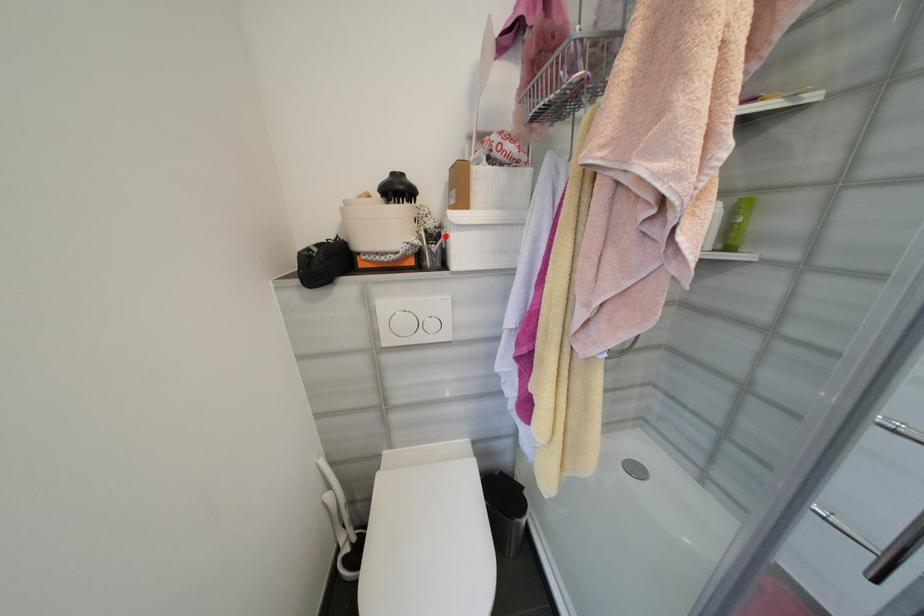
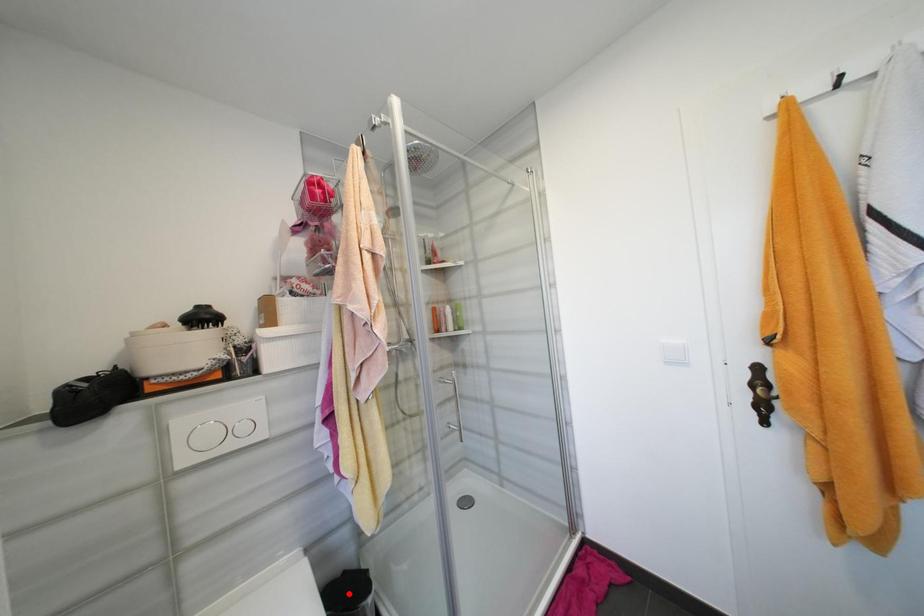
I am providing you with two images of the same scene from different viewpoints. A red point is marked on the first image and another point is marked on the second image. Is the red point in image1 aligned with the point shown in image2?

No